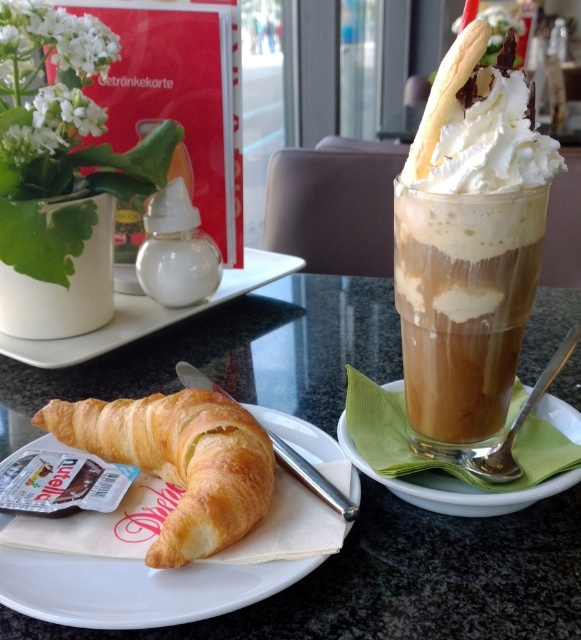
Question: Considering the relative positions of black matte croissant at lower left and green napkin at center in the image provided, where is black matte croissant at lower left located with respect to green napkin at center?

Choices:
 (A) above
 (B) below

Answer: (A)

Question: Estimate the real-world distances between objects in this image. Which object is farther from the green napkin at center?

Choices:
 (A) golden brown croissant at center
 (B) golden brown flaky croissant at lower left
 (C) black matte croissant at lower left
 (D) white ceramic plate at upper center

Answer: (D)

Question: Which object appears farthest from the camera in this image?

Choices:
 (A) white ceramic plate at upper center
 (B) caramel frosted glass at right
 (C) golden brown croissant at center
 (D) green napkin at center

Answer: (A)

Question: Is black matte croissant at lower left to the left of white ceramic plate at upper center from the viewer's perspective?

Choices:
 (A) no
 (B) yes

Answer: (A)

Question: Which object appears farthest from the camera in this image?

Choices:
 (A) golden brown croissant at center
 (B) black matte croissant at lower left
 (C) white ceramic plate at upper center
 (D) caramel frosted glass at right

Answer: (C)

Question: From the image, what is the correct spatial relationship of black matte croissant at lower left in relation to caramel frosted glass at right?

Choices:
 (A) above
 (B) below

Answer: (B)